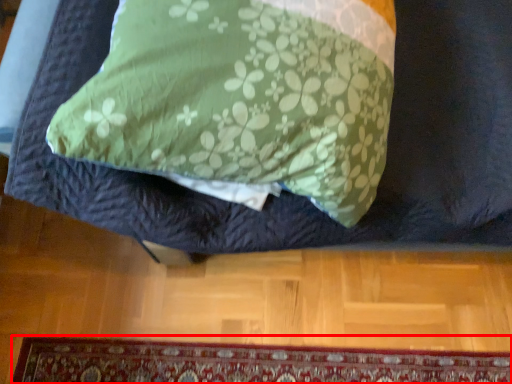
Question: From the image's perspective, what is the correct spatial positioning of mat (annotated by the red box) in reference to furniture?

Choices:
 (A) below
 (B) above

Answer: (A)